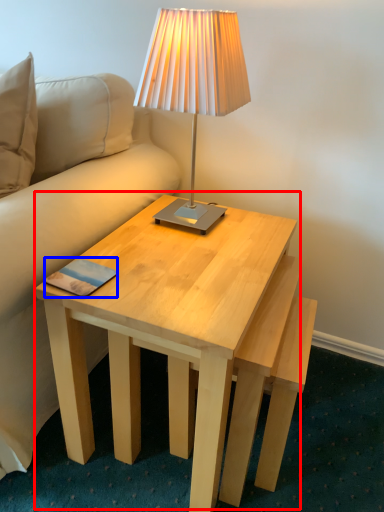
Question: Which point is closer to the camera, coffee table (highlighted by a red box) or pad (highlighted by a blue box)?

Choices:
 (A) coffee table
 (B) pad

Answer: (A)